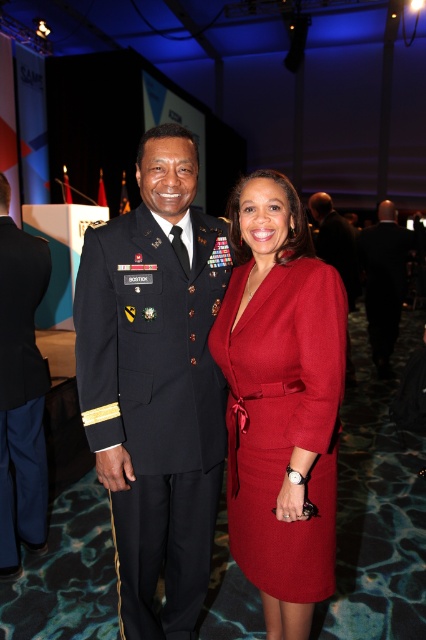
You are standing in the conference hall and want to move from point A to point B. Point A is at coordinate point [143,602] and point B is at coordinate point [298,515]. Which point is closer to you?

Point A at coordinate point [143,602] is closer to you than point B at coordinate point [298,515].